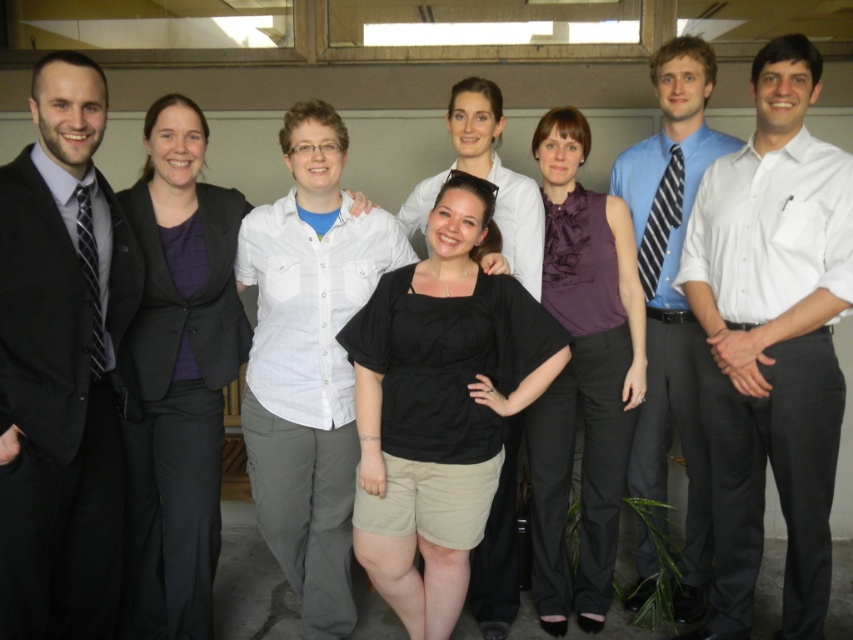
You are standing in the room and want to hand a document to the person wearing the black suit at left and the person wearing the matte black blazer at left. Which one do you approach first to ensure you can reach them without moving past the other?

You should approach the black suit at left first because it is closer to you than the matte black blazer at left, so you can reach them without needing to move past the other person.

You are organizing a photo shoot and need to arrange the black suit at left and the purple satin blouse at center based on their sizes. Which one should you place in a position that requires less space?

The black suit at left has a smaller size compared to the purple satin blouse at center, so it should be placed in a position that requires less space.